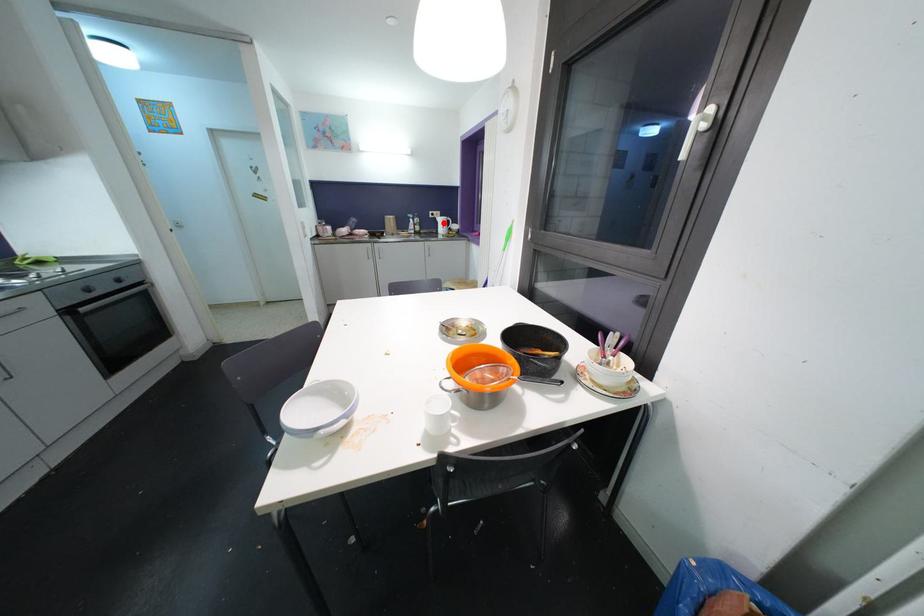
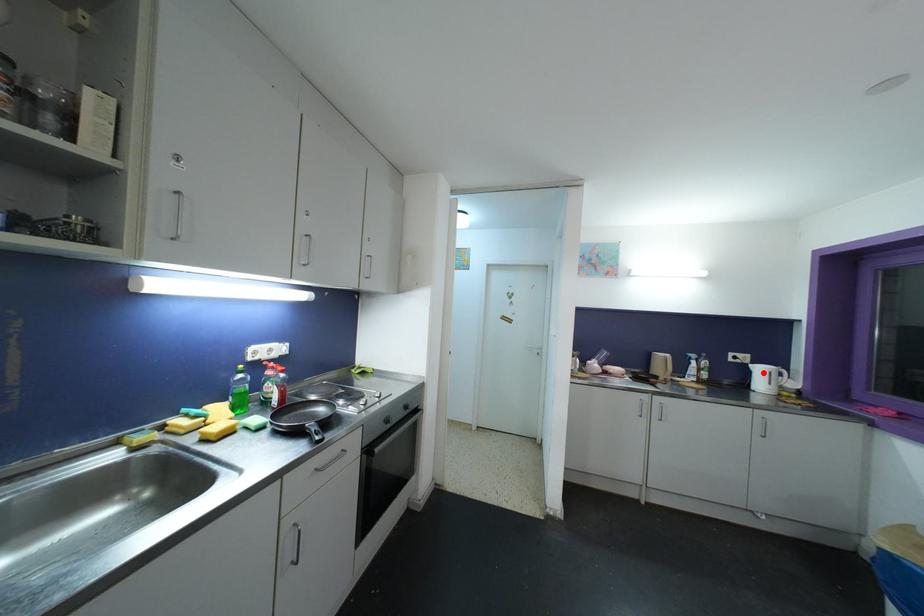
I am providing you with two images of the same scene from different viewpoints. A red point is marked on the first image and another point is marked on the second image. Does the point marked in image1 correspond to the same location as the one in image2?

Yes